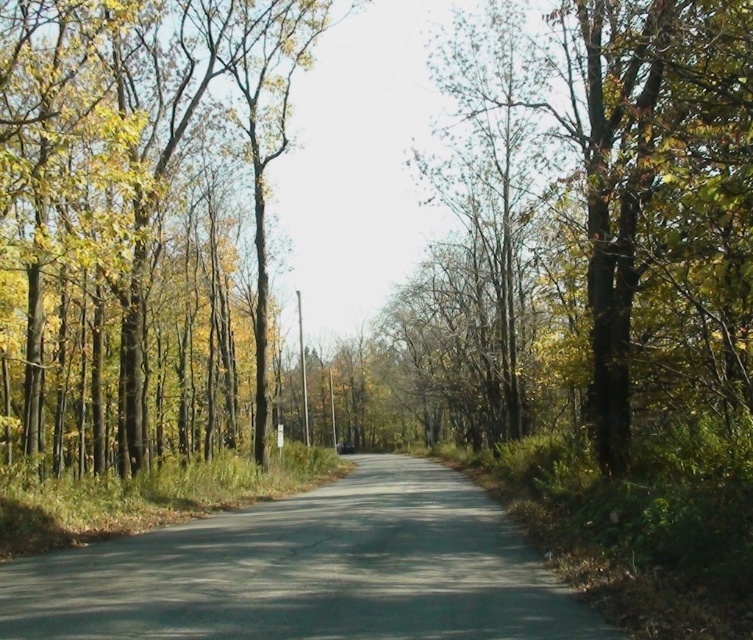
Is green matte tree at right closer to the viewer compared to gray asphalt road at center?

No, it is not.

Who is shorter, green matte tree at right or gray asphalt road at center?

With less height is gray asphalt road at center.

Is point (473, 26) positioned before point (172, 557)?

That is False.

This screenshot has width=753, height=640. What are the coordinates of `green matte tree at right` in the screenshot? It's located at (648, 193).

Who is lower down, yellow-green leaves at left or green matte tree at right?

yellow-green leaves at left is below.

Is yellow-green leaves at left bigger than green matte tree at right?

Correct, yellow-green leaves at left is larger in size than green matte tree at right.

Does point (23, 108) lie behind point (630, 426)?

Yes.

I want to click on yellow-green leaves at left, so click(139, 225).

Is yellow-green leaves at left closer to camera compared to gray asphalt road at center?

No, yellow-green leaves at left is further to the viewer.

Identify the location of yellow-green leaves at left. This screenshot has width=753, height=640. (139, 225).